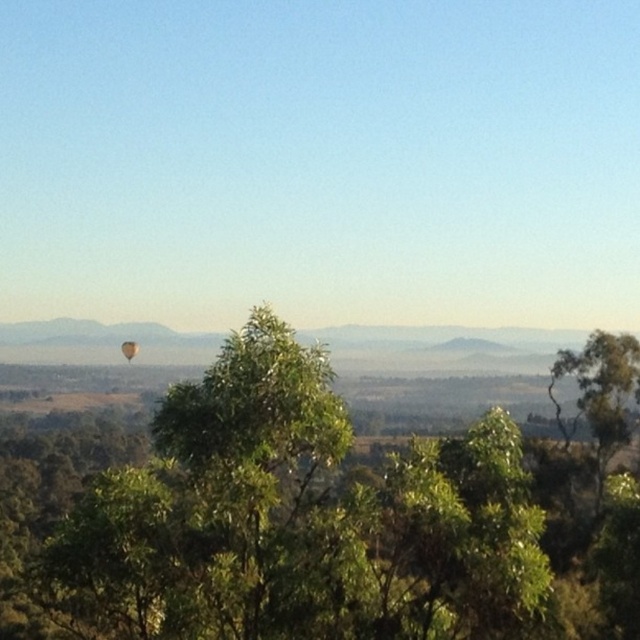
You are standing at the point with coordinates point (125, 342) and want to walk towards the hot air balloon in the distance. Is the point point (612, 406) blocking your path?

Point (612, 406) is in front of point (125, 342), so yes, the point point (612, 406) is blocking your path.

You are standing in the serene landscape and want to walk towards the green leafy tree at right. Which direction should you move relative to the green leafy tree at center?

To reach the green leafy tree at right, you should move to the right side of the green leafy tree at center since the green leafy tree at center is closer to you than the green leafy tree at right, meaning the latter is further away and positioned to the right in the background.

What object is located at the coordinates point (300, 522) in the image?

The point (300, 522) indicates the green leafy tree at center.